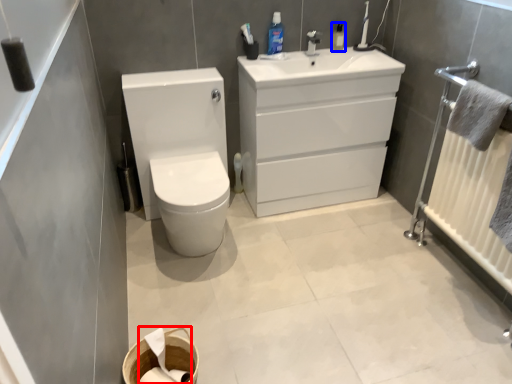
Question: Which object is closer to the camera taking this photo, toilet paper (highlighted by a red box) or mouthwash (highlighted by a blue box)?

Choices:
 (A) toilet paper
 (B) mouthwash

Answer: (A)